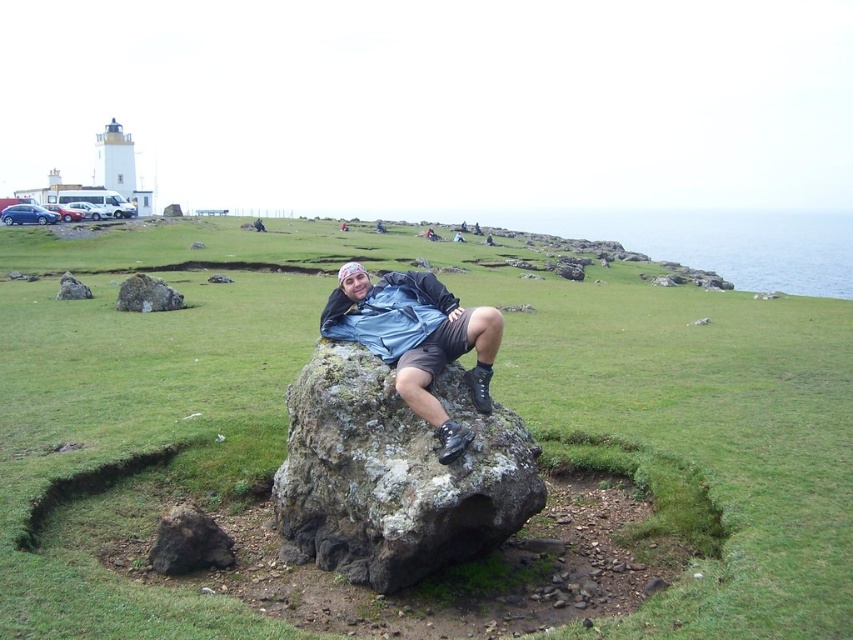
Question: Does green grassy at center appear over rusty rock at center?

Choices:
 (A) yes
 (B) no

Answer: (A)

Question: Observing the image, what is the correct spatial positioning of rusty rock at center in reference to matte blue shirt at center?

Choices:
 (A) right
 (B) left

Answer: (B)

Question: Which of the following is the closest to the observer?

Choices:
 (A) rusty rock at center
 (B) green grassy at center

Answer: (B)

Question: Among these objects, which one is farthest from the camera?

Choices:
 (A) green grassy at center
 (B) matte blue shirt at center
 (C) rusty rock at center

Answer: (C)

Question: Which object appears closest to the camera in this image?

Choices:
 (A) rusty rock at center
 (B) matte blue shirt at center
 (C) green grassy at center

Answer: (C)

Question: Can you confirm if rusty rock at center is positioned above matte blue shirt at center?

Choices:
 (A) no
 (B) yes

Answer: (A)